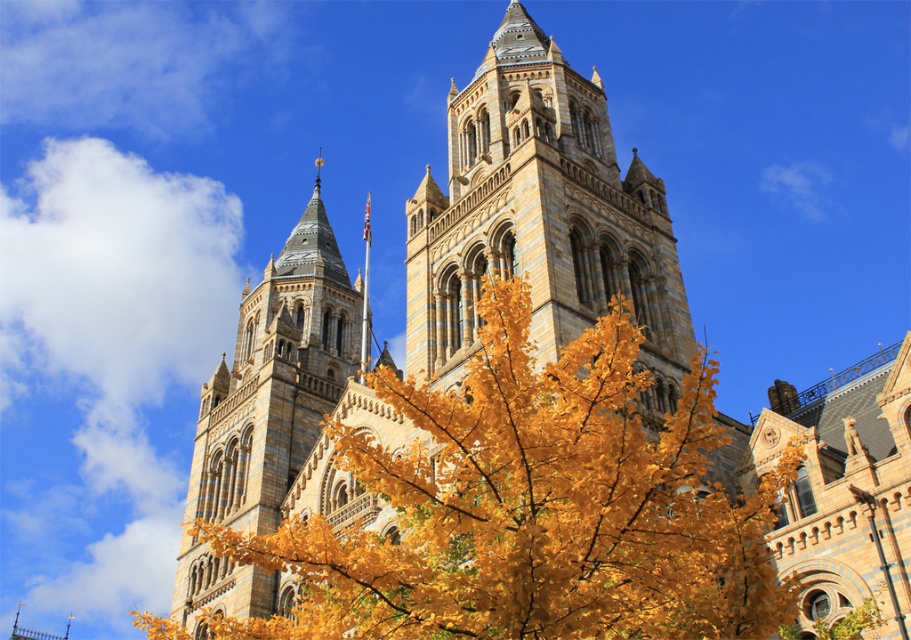
Which is above, brown stone tower at center or stone tower at center?

Positioned higher is brown stone tower at center.

Which is below, brown stone tower at center or stone tower at center?

stone tower at center

Image resolution: width=911 pixels, height=640 pixels. Describe the element at coordinates (540, 218) in the screenshot. I see `brown stone tower at center` at that location.

You are a GUI agent. You are given a task and a screenshot of the screen. Output one action in this format:
    pyautogui.click(x=<x>, y=<y>)
    Task: Click on the brown stone tower at center
    This screenshot has height=640, width=911.
    Given the screenshot: What is the action you would take?
    pyautogui.click(x=540, y=218)